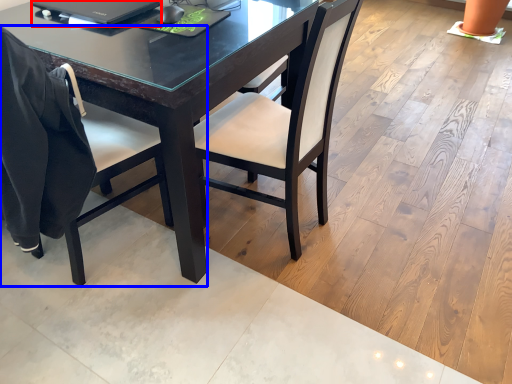
Question: Which object is further to the camera taking this photo, laptop (highlighted by a red box) or chair (highlighted by a blue box)?

Choices:
 (A) laptop
 (B) chair

Answer: (A)